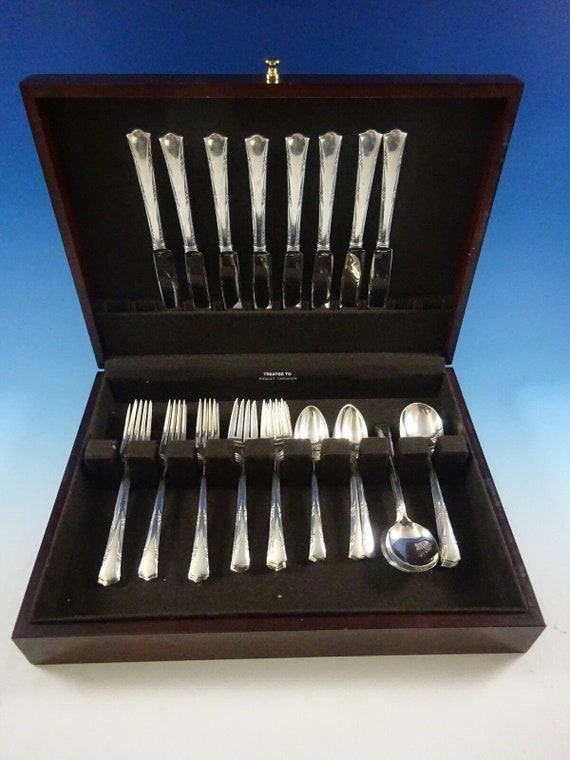
Find the location of a particular element. Image resolution: width=570 pixels, height=760 pixels. spoons is located at coordinates (314, 496), (352, 492), (396, 486), (435, 486).